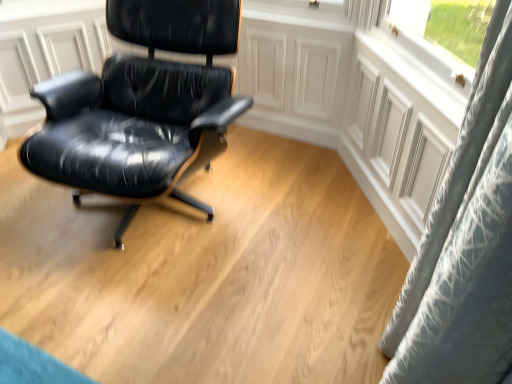
Find the location of a particular element. The width and height of the screenshot is (512, 384). glossy black leather chair at center is located at coordinates (140, 103).

Describe the element at coordinates (140, 103) in the screenshot. Image resolution: width=512 pixels, height=384 pixels. I see `glossy black leather chair at center` at that location.

The height and width of the screenshot is (384, 512). I want to click on blue textured curtain at upper right, so click(x=465, y=245).

This screenshot has width=512, height=384. What do you see at coordinates (465, 245) in the screenshot? I see `blue textured curtain at upper right` at bounding box center [465, 245].

At what (x,y) coordinates should I click in order to perform the action: click on glossy black leather chair at center. Please return your answer as a coordinate pair (x, y). Looking at the image, I should click on (140, 103).

Which object is positioned more to the right, glossy black leather chair at center or blue textured curtain at upper right?

blue textured curtain at upper right is more to the right.

Which object is more forward, glossy black leather chair at center or blue textured curtain at upper right?

glossy black leather chair at center.

Does point (172, 119) appear closer or farther from the camera than point (493, 56)?

Point (172, 119) is farther from the camera than point (493, 56).

From the image's perspective, between glossy black leather chair at center and blue textured curtain at upper right, which one is located above?

glossy black leather chair at center is shown above in the image.

From a real-world perspective, is glossy black leather chair at center on blue textured curtain at upper right?

Yes, from a real-world perspective, glossy black leather chair at center is over blue textured curtain at upper right

In terms of width, does glossy black leather chair at center look wider or thinner when compared to blue textured curtain at upper right?

glossy black leather chair at center is wider than blue textured curtain at upper right.

Who is taller, glossy black leather chair at center or blue textured curtain at upper right?

Standing taller between the two is glossy black leather chair at center.

Which of these two, glossy black leather chair at center or blue textured curtain at upper right, is bigger?

With larger size is glossy black leather chair at center.

Is glossy black leather chair at center situated inside blue textured curtain at upper right or outside?

glossy black leather chair at center is outside blue textured curtain at upper right.

Are glossy black leather chair at center and blue textured curtain at upper right beside each other?

No.

Could you tell me if glossy black leather chair at center is facing blue textured curtain at upper right?

No, glossy black leather chair at center is not turned towards blue textured curtain at upper right.

The height and width of the screenshot is (384, 512). Identify the location of chair on the left of blue textured curtain at upper right. (140, 103).

Considering the positions of objects blue textured curtain at upper right and glossy black leather chair at center in the image provided, who is more to the right, blue textured curtain at upper right or glossy black leather chair at center?

From the viewer's perspective, blue textured curtain at upper right appears more on the right side.

Does blue textured curtain at upper right lie in front of glossy black leather chair at center?

No, the depth of blue textured curtain at upper right is greater than that of glossy black leather chair at center.

Which is behind, point (392, 348) or point (165, 50)?

The point (165, 50) is more distant.

From the image's perspective, is blue textured curtain at upper right positioned above or below glossy black leather chair at center?

From the image's perspective, blue textured curtain at upper right appears below glossy black leather chair at center.

From a real-world perspective, is blue textured curtain at upper right located higher than glossy black leather chair at center?

No.

Looking at this image, can you confirm if blue textured curtain at upper right is wider than glossy black leather chair at center?

Incorrect, the width of blue textured curtain at upper right does not surpass that of glossy black leather chair at center.

Between blue textured curtain at upper right and glossy black leather chair at center, which one has less height?

blue textured curtain at upper right is shorter.

Based on their sizes in the image, would you say blue textured curtain at upper right is bigger or smaller than glossy black leather chair at center?

In the image, blue textured curtain at upper right appears to be smaller than glossy black leather chair at center.

Is blue textured curtain at upper right not within glossy black leather chair at center?

Yes.

Would you say blue textured curtain at upper right is a long distance from glossy black leather chair at center?

Absolutely, blue textured curtain at upper right is distant from glossy black leather chair at center.

Is blue textured curtain at upper right oriented towards glossy black leather chair at center?

Yes, blue textured curtain at upper right is aimed at glossy black leather chair at center.

Can you tell me how much blue textured curtain at upper right and glossy black leather chair at center differ in facing direction?

The angular difference between blue textured curtain at upper right and glossy black leather chair at center is 59.8 degrees.

The width and height of the screenshot is (512, 384). I want to click on curtain beneath the glossy black leather chair at center (from a real-world perspective), so click(465, 245).

Image resolution: width=512 pixels, height=384 pixels. I want to click on curtain on the right of glossy black leather chair at center, so click(x=465, y=245).

Find the location of a particular element. This screenshot has height=384, width=512. curtain that appears behind the glossy black leather chair at center is located at coordinates (465, 245).